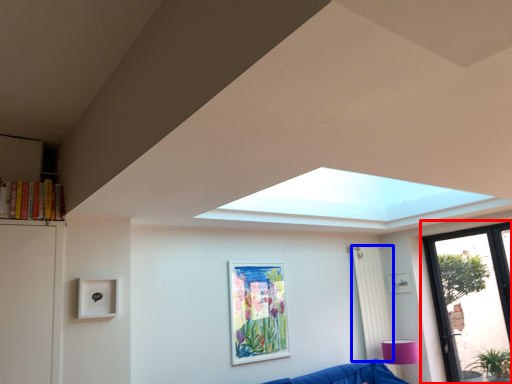
Question: Among these objects, which one is farthest to the camera, window (highlighted by a red box) or curtain (highlighted by a blue box)?

Choices:
 (A) window
 (B) curtain

Answer: (B)